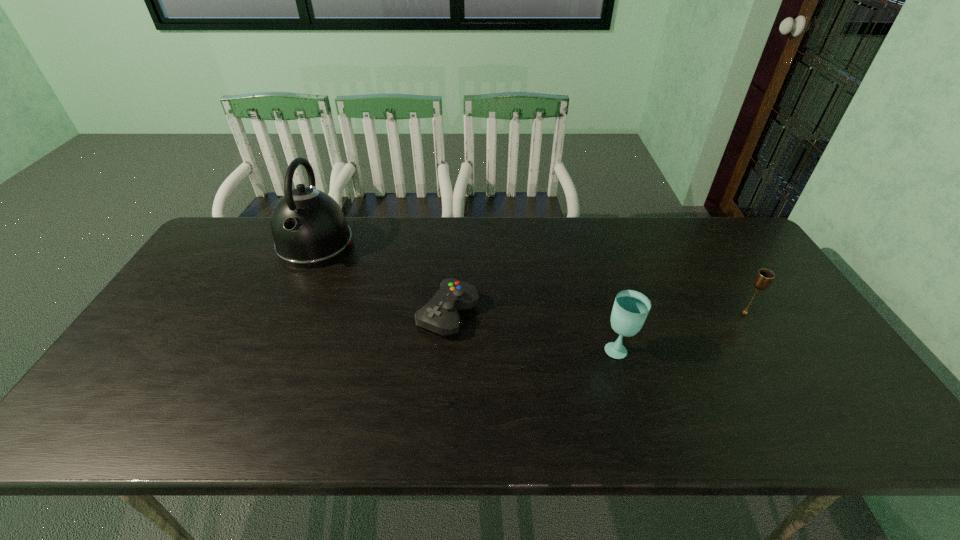
Locate an element on the screen. The height and width of the screenshot is (540, 960). unoccupied position between the shortest object and the chalice is located at coordinates tap(597, 313).

Locate an element on the screen. Image resolution: width=960 pixels, height=540 pixels. free spot between the chalice and the leftmost object is located at coordinates (531, 279).

This screenshot has height=540, width=960. Find the location of `free area in between the control and the chalice`. free area in between the control and the chalice is located at coordinates (597, 313).

At what (x,y) coordinates should I click in order to perform the action: click on free space between the second shortest object and the control. Please return your answer as a coordinate pair (x, y). The height and width of the screenshot is (540, 960). Looking at the image, I should click on (597, 313).

Locate an element on the screen. This screenshot has height=540, width=960. free space between the chalice and the second tallest object is located at coordinates (682, 330).

This screenshot has height=540, width=960. Find the location of `free space that is in between the control and the chalice`. free space that is in between the control and the chalice is located at coordinates coord(597,313).

The height and width of the screenshot is (540, 960). Find the location of `object that is the second closest to the tallest object`. object that is the second closest to the tallest object is located at coordinates (630, 309).

This screenshot has width=960, height=540. Identify the location of the second closest object relative to the leftmost object. (630, 309).

Where is `blank space that satisfies the following two spatial constraints: 1. on the spout of the kettle; 2. on the left side of the second object from right to left`? This screenshot has width=960, height=540. blank space that satisfies the following two spatial constraints: 1. on the spout of the kettle; 2. on the left side of the second object from right to left is located at coordinates point(269,349).

Identify the location of vacant area in the image that satisfies the following two spatial constraints: 1. on the back side of the second object from left to right; 2. on the left side of the chalice. The image size is (960, 540). (448, 313).